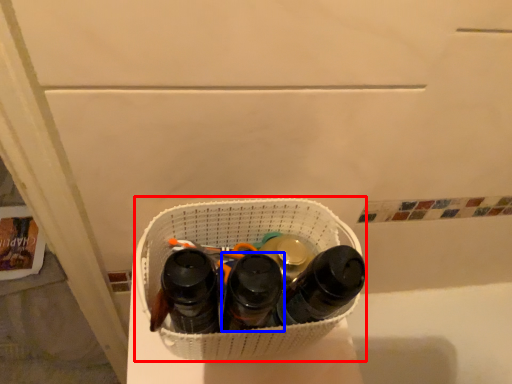
Question: Which object is further to the camera taking this photo, laundry basket (highlighted by a red box) or footwear (highlighted by a blue box)?

Choices:
 (A) laundry basket
 (B) footwear

Answer: (A)